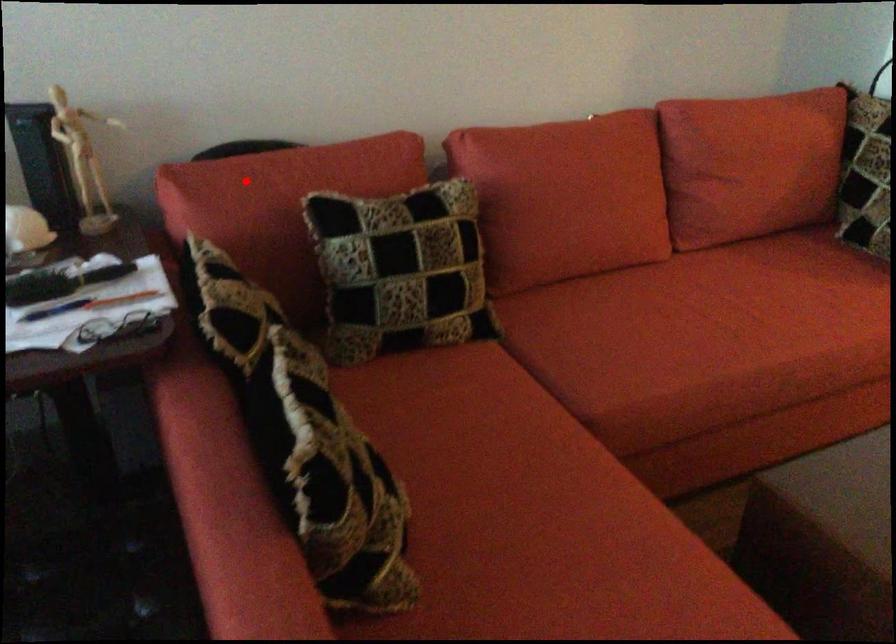
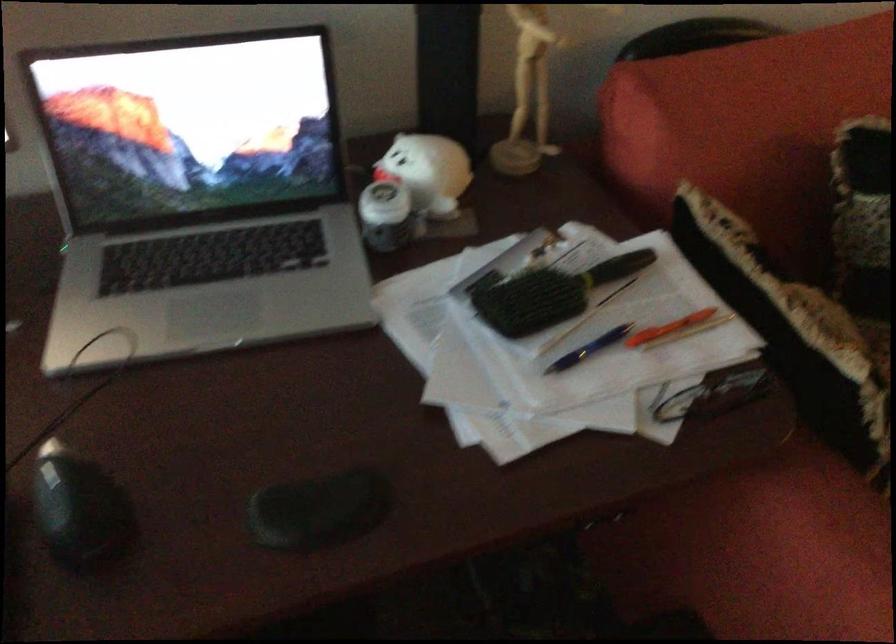
Find the pixel in the second image that matches the highlighted location in the first image.

(746, 96)